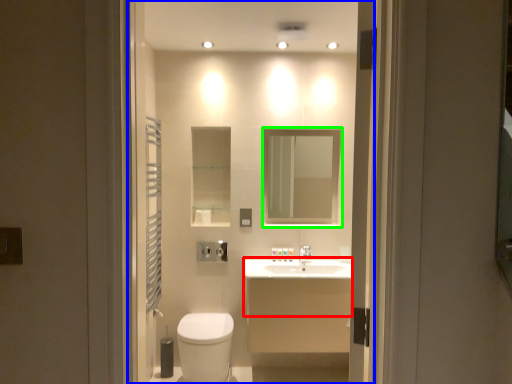
Question: Which object is positioned closest to counter top (highlighted by a red box)? Select from residence (highlighted by a blue box) and mirror (highlighted by a green box).

Choices:
 (A) residence
 (B) mirror

Answer: (A)